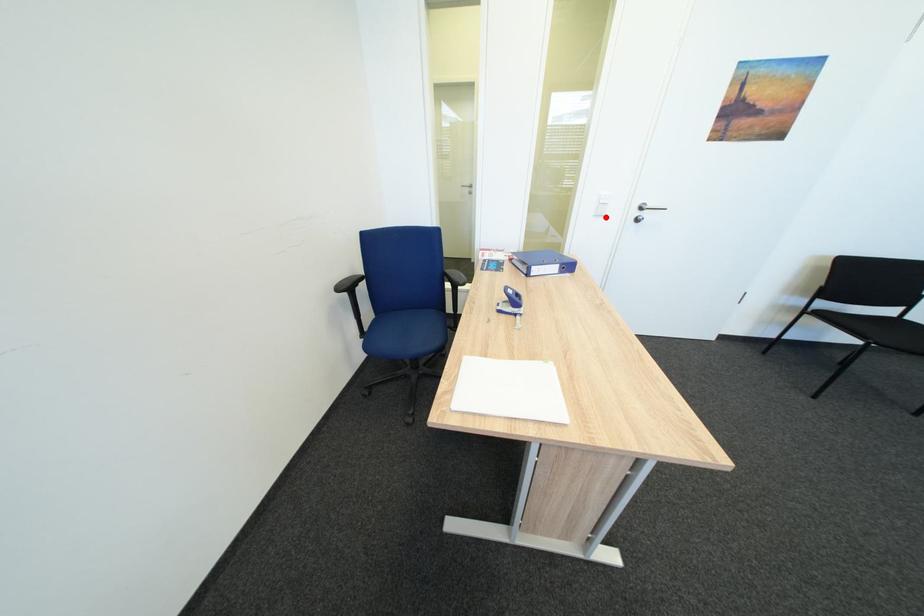
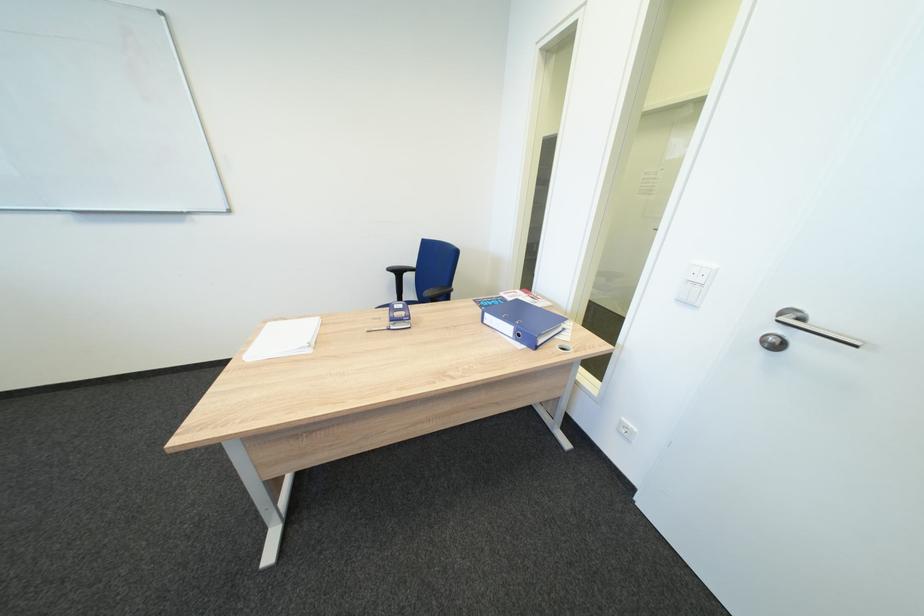
Question: A red point is marked in image1. In image2, is the corresponding 3D point closer to the camera or farther? Reply with the corresponding letter.

Choices:
 (A) The corresponding 3D point is closer.
 (B) The corresponding 3D point is farther.

Answer: (B)